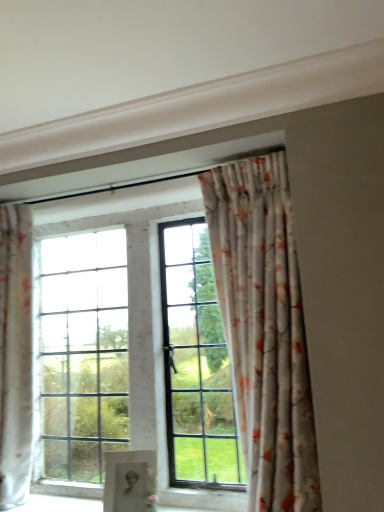
Question: Can you confirm if white glossy wood at lower center is thinner than floral fabric curtain at left, arranged as the second curtain when viewed from the right?

Choices:
 (A) yes
 (B) no

Answer: (A)

Question: Are white glossy wood at lower center and floral fabric curtain at left, arranged as the 1th curtain when viewed from the left, making contact?

Choices:
 (A) no
 (B) yes

Answer: (A)

Question: From the image's perspective, is white glossy wood at lower center above floral fabric curtain at left, arranged as the 1th curtain when viewed from the left?

Choices:
 (A) no
 (B) yes

Answer: (A)

Question: From the image's perspective, is white glossy wood at lower center under floral fabric curtain at left, arranged as the second curtain when viewed from the right?

Choices:
 (A) no
 (B) yes

Answer: (B)

Question: Considering the relative sizes of white glossy wood at lower center and floral fabric curtain at left, arranged as the 1th curtain when viewed from the left, in the image provided, is white glossy wood at lower center shorter than floral fabric curtain at left, arranged as the 1th curtain when viewed from the left,?

Choices:
 (A) no
 (B) yes

Answer: (B)

Question: Is white glossy wood at lower center facing towards floral fabric curtain at left, arranged as the second curtain when viewed from the right?

Choices:
 (A) yes
 (B) no

Answer: (B)

Question: Can you confirm if floral fabric curtain at left, arranged as the 1th curtain when viewed from the left, is smaller than matte black portrait at center?

Choices:
 (A) no
 (B) yes

Answer: (A)

Question: From the image's perspective, would you say floral fabric curtain at left, arranged as the second curtain when viewed from the right, is positioned over matte black portrait at center?

Choices:
 (A) yes
 (B) no

Answer: (A)

Question: From a real-world perspective, is floral fabric curtain at left, arranged as the second curtain when viewed from the right, physically above matte black portrait at center?

Choices:
 (A) no
 (B) yes

Answer: (B)

Question: Considering the relative sizes of floral fabric curtain at left, arranged as the 1th curtain when viewed from the left, and matte black portrait at center in the image provided, is floral fabric curtain at left, arranged as the 1th curtain when viewed from the left, wider than matte black portrait at center?

Choices:
 (A) no
 (B) yes

Answer: (B)

Question: Considering the relative positions of floral fabric curtain at left, arranged as the 1th curtain when viewed from the left, and matte black portrait at center in the image provided, is floral fabric curtain at left, arranged as the 1th curtain when viewed from the left, to the left of matte black portrait at center from the viewer's perspective?

Choices:
 (A) no
 (B) yes

Answer: (B)

Question: Is matte black portrait at center a part of floral fabric curtain at left, arranged as the 1th curtain when viewed from the left?

Choices:
 (A) yes
 (B) no

Answer: (B)

Question: Can you confirm if floral fabric curtain at left, arranged as the second curtain when viewed from the right, is bigger than floral fabric curtain at upper center, arranged as the 2th curtain when viewed from the left?

Choices:
 (A) yes
 (B) no

Answer: (B)